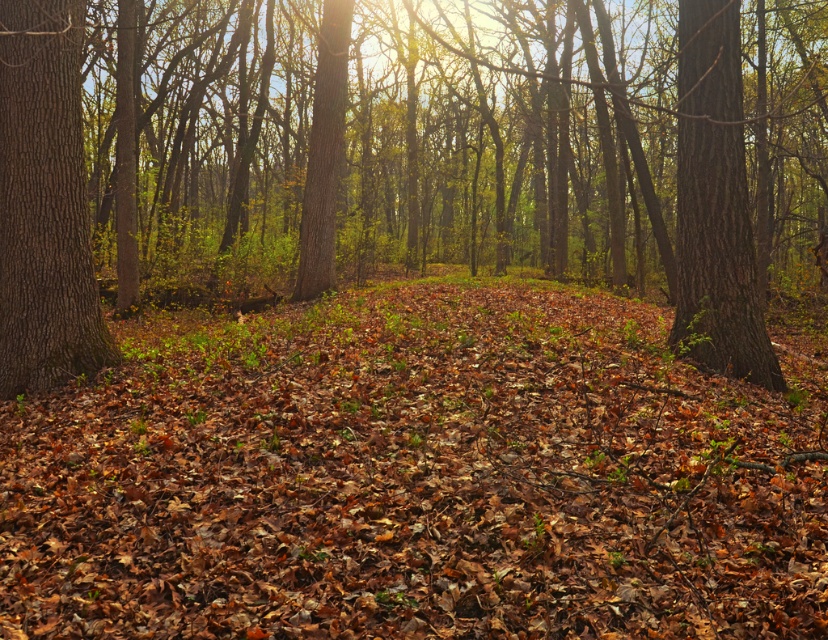
Question: Is brown leaf litter at center below smooth brown tree trunk at center-right?

Choices:
 (A) yes
 (B) no

Answer: (A)

Question: Considering the real-world distances, which object is farthest from the smooth brown tree trunk at center-right?

Choices:
 (A) brown leaf litter at center
 (B) brown rough tree trunk at center

Answer: (B)

Question: Which point is farther to the camera?

Choices:
 (A) (172, 509)
 (B) (585, 60)
 (C) (730, 113)
 (D) (42, 136)

Answer: (B)

Question: Which point is farther from the camera taking this photo?

Choices:
 (A) (47, 230)
 (B) (679, 264)
 (C) (292, 339)
 (D) (499, 196)

Answer: (D)

Question: Is brown rough tree trunk at center positioned before smooth brown tree trunk at left?

Choices:
 (A) no
 (B) yes

Answer: (B)

Question: Is brown rough tree trunk at center below smooth brown tree trunk at left?

Choices:
 (A) no
 (B) yes

Answer: (A)